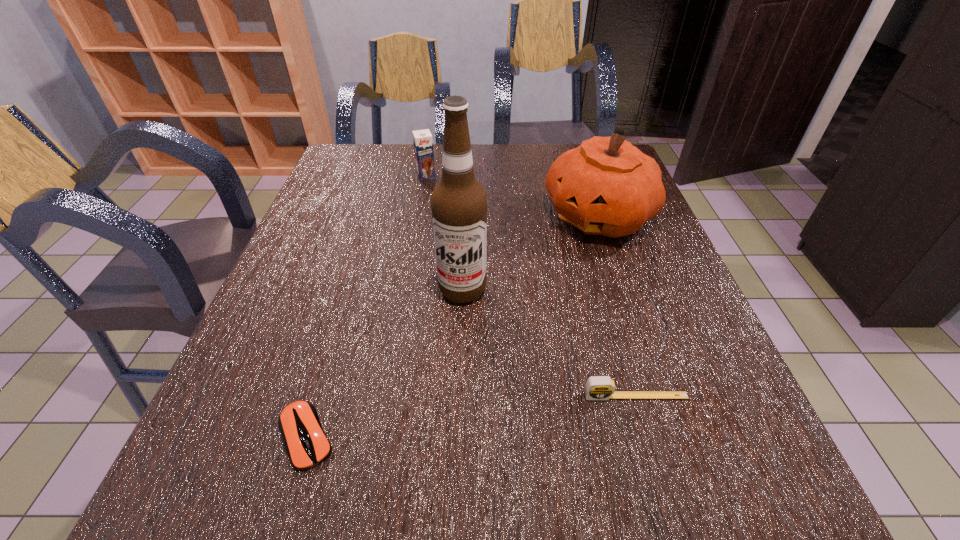
The width and height of the screenshot is (960, 540). I want to click on object present at the far edge, so click(423, 143).

Locate an element on the screen. The height and width of the screenshot is (540, 960). computer mouse that is at the near edge is located at coordinates (308, 446).

Where is `tape measure situated at the near edge`? Image resolution: width=960 pixels, height=540 pixels. tape measure situated at the near edge is located at coordinates (597, 387).

You are a GUI agent. You are given a task and a screenshot of the screen. Output one action in this format:
    pyautogui.click(x=<x>, y=<y>)
    Task: Click on the object located in the left edge section of the desktop
    Image resolution: width=960 pixels, height=540 pixels.
    Given the screenshot: What is the action you would take?
    pyautogui.click(x=308, y=446)

Locate an element on the screen. The height and width of the screenshot is (540, 960). tape measure that is at the right edge is located at coordinates click(597, 387).

Locate an element on the screen. This screenshot has height=540, width=960. pumpkin at the right edge is located at coordinates (606, 186).

The image size is (960, 540). I want to click on object that is positioned at the near left corner, so click(x=308, y=446).

Locate an element on the screen. object present at the near right corner is located at coordinates (597, 387).

The height and width of the screenshot is (540, 960). In order to click on vacant point at the far edge in this screenshot , I will do `click(565, 145)`.

You are a GUI agent. You are given a task and a screenshot of the screen. Output one action in this format:
    pyautogui.click(x=<x>, y=<y>)
    Task: Click on the vacant space at the near edge
    
    Given the screenshot: What is the action you would take?
    pyautogui.click(x=586, y=406)